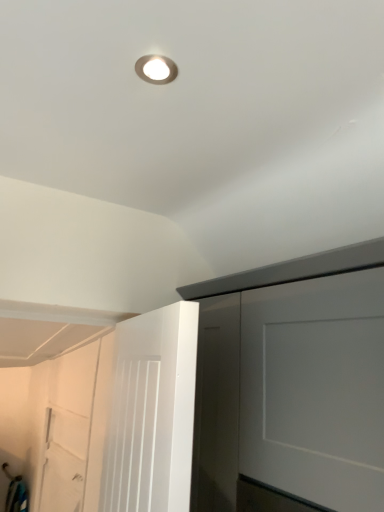
Question: Would you say matte silver droplight at upper center contains white matte door at lower left?

Choices:
 (A) yes
 (B) no

Answer: (B)

Question: From a real-world perspective, is matte silver droplight at upper center positioned under white matte door at lower left based on gravity?

Choices:
 (A) no
 (B) yes

Answer: (A)

Question: Considering the relative sizes of matte silver droplight at upper center and white matte door at lower left in the image provided, is matte silver droplight at upper center thinner than white matte door at lower left?

Choices:
 (A) no
 (B) yes

Answer: (A)

Question: Is matte silver droplight at upper center not near white matte door at lower left?

Choices:
 (A) no
 (B) yes

Answer: (B)

Question: From a real-world perspective, is matte silver droplight at upper center located higher than white matte door at lower left?

Choices:
 (A) yes
 (B) no

Answer: (A)

Question: From a real-world perspective, is white matte door at lower left above or below matte silver droplight at upper center?

Choices:
 (A) below
 (B) above

Answer: (A)

Question: Does point (112, 409) appear closer or farther from the camera than point (165, 72)?

Choices:
 (A) farther
 (B) closer

Answer: (B)

Question: Is white matte door at lower left inside or outside of matte silver droplight at upper center?

Choices:
 (A) inside
 (B) outside

Answer: (B)

Question: Based on their sizes in the image, would you say white matte door at lower left is bigger or smaller than matte silver droplight at upper center?

Choices:
 (A) small
 (B) big

Answer: (B)

Question: Is matte silver droplight at upper center wider or thinner than white matte door at lower left?

Choices:
 (A) wide
 (B) thin

Answer: (A)

Question: From a real-world perspective, is matte silver droplight at upper center physically located above or below white matte door at lower left?

Choices:
 (A) below
 (B) above

Answer: (B)

Question: Relative to white matte door at lower left, is matte silver droplight at upper center in front or behind?

Choices:
 (A) behind
 (B) front

Answer: (B)

Question: Based on their sizes in the image, would you say matte silver droplight at upper center is bigger or smaller than white matte door at lower left?

Choices:
 (A) big
 (B) small

Answer: (B)

Question: Is point (137, 62) closer or farther from the camera than point (144, 318)?

Choices:
 (A) closer
 (B) farther

Answer: (A)

Question: Is matte silver droplight at upper center to the left or to the right of white matte door at lower left in the image?

Choices:
 (A) right
 (B) left

Answer: (A)